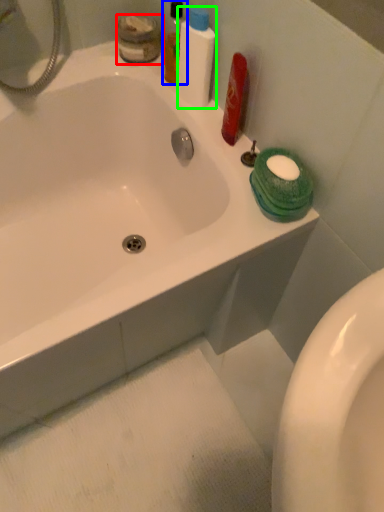
Question: Which object is the closest to the toiletry (highlighted by a red box)? Choose among these: mouthwash (highlighted by a blue box) or cleaning product (highlighted by a green box).

Choices:
 (A) mouthwash
 (B) cleaning product

Answer: (A)